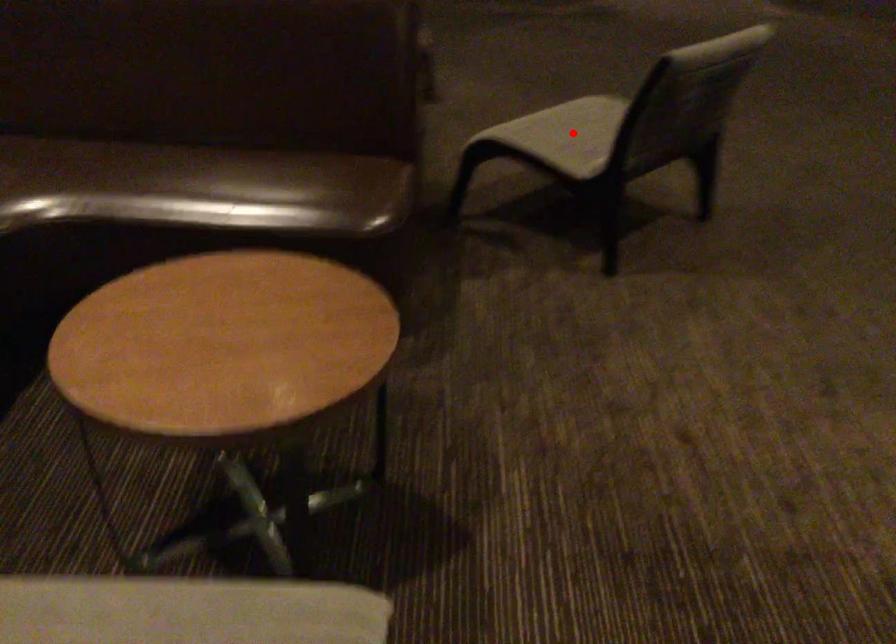
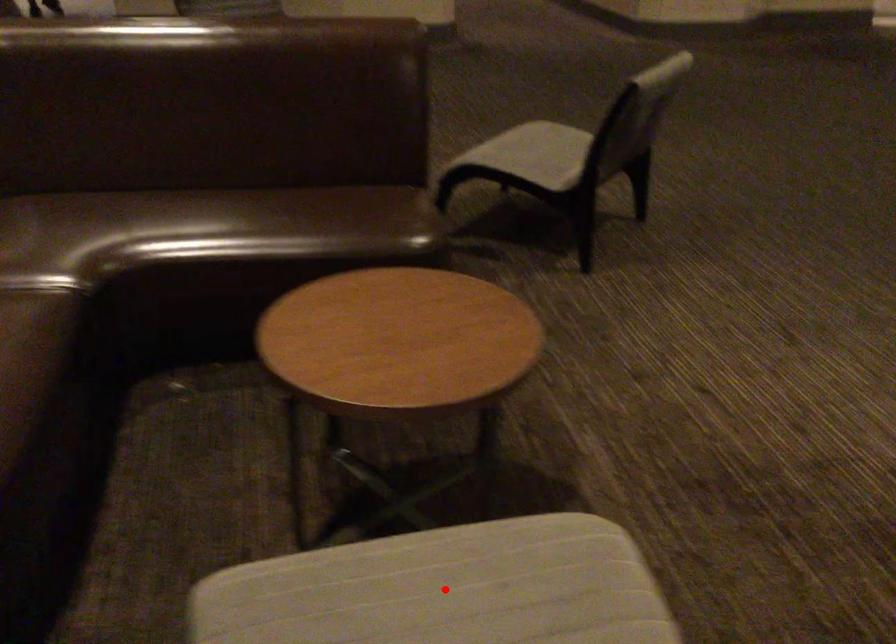
I am providing you with two images of the same scene from different viewpoints. A red point is marked on the first image and another point is marked on the second image. Is the red point in image1 aligned with the point shown in image2?

No